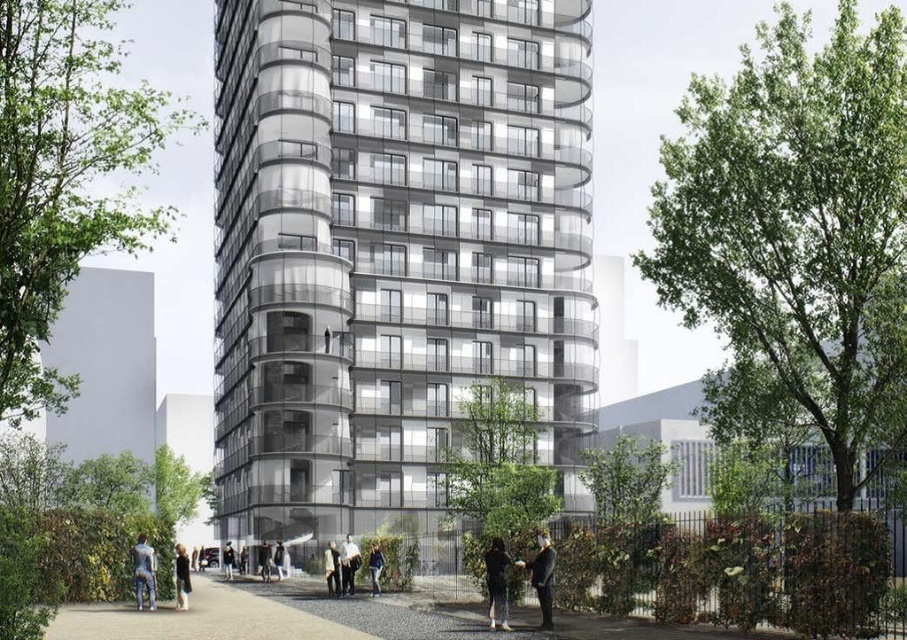
Which of these two, light brown leather jacket at lower left or denim jacket at lower center, stands taller?

Standing taller between the two is light brown leather jacket at lower left.

Between point (184, 609) and point (374, 557), which one is positioned behind?

The point (374, 557) is behind.

Does point (177, 596) lie in front of point (375, 556)?

Yes, it is.

Where is `light brown leather jacket at lower left`? The height and width of the screenshot is (640, 907). light brown leather jacket at lower left is located at coordinates (181, 577).

Is dark gray fabric jacket at lower center to the right of dark gray fabric jacket at lower left from the viewer's perspective?

Correct, you'll find dark gray fabric jacket at lower center to the right of dark gray fabric jacket at lower left.

Does dark gray fabric jacket at lower center come behind dark gray fabric jacket at lower left?

No, dark gray fabric jacket at lower center is closer to the viewer.

Which is in front, point (489, 548) or point (149, 588)?

Positioned in front is point (489, 548).

This screenshot has width=907, height=640. What are the coordinates of `dark gray fabric jacket at lower center` in the screenshot? It's located at (496, 584).

Is dark gray fabric jacket at lower left thinner than light brown leather jacket at lower left?

Indeed, dark gray fabric jacket at lower left has a lesser width compared to light brown leather jacket at lower left.

From the picture: Can you confirm if dark gray fabric jacket at lower left is positioned above light brown leather jacket at lower left?

Yes, dark gray fabric jacket at lower left is above light brown leather jacket at lower left.

Is point (142, 570) less distant than point (180, 604)?

No, (142, 570) is further to viewer.

Where is `dark gray fabric jacket at lower left`? The image size is (907, 640). dark gray fabric jacket at lower left is located at coordinates (143, 572).